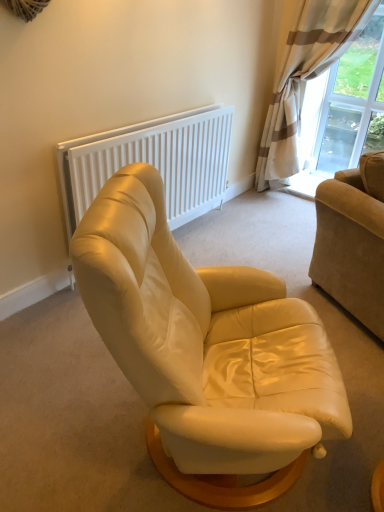
Question: Can you confirm if matte cream leather armchair at center is bigger than beige striped curtain at upper right?

Choices:
 (A) yes
 (B) no

Answer: (B)

Question: Is there a large distance between matte cream leather armchair at center and beige striped curtain at upper right?

Choices:
 (A) no
 (B) yes

Answer: (B)

Question: Can you confirm if matte cream leather armchair at center is shorter than beige striped curtain at upper right?

Choices:
 (A) no
 (B) yes

Answer: (B)

Question: Is matte cream leather armchair at center positioned with its back to beige striped curtain at upper right?

Choices:
 (A) no
 (B) yes

Answer: (A)

Question: Considering the relative positions of matte cream leather armchair at center and beige striped curtain at upper right in the image provided, is matte cream leather armchair at center to the left of beige striped curtain at upper right from the viewer's perspective?

Choices:
 (A) no
 (B) yes

Answer: (B)

Question: Is matte cream leather armchair at center not within beige striped curtain at upper right?

Choices:
 (A) yes
 (B) no

Answer: (A)

Question: From the image's perspective, would you say beige corduroy couch at right is positioned over transparent glass window at upper right?

Choices:
 (A) no
 (B) yes

Answer: (A)

Question: Can you confirm if beige corduroy couch at right is wider than transparent glass window at upper right?

Choices:
 (A) yes
 (B) no

Answer: (A)

Question: Would you say transparent glass window at upper right is part of beige corduroy couch at right's contents?

Choices:
 (A) no
 (B) yes

Answer: (A)

Question: From the image's perspective, is beige corduroy couch at right beneath transparent glass window at upper right?

Choices:
 (A) yes
 (B) no

Answer: (A)

Question: Is the position of beige corduroy couch at right more distant than that of transparent glass window at upper right?

Choices:
 (A) yes
 (B) no

Answer: (B)

Question: Is beige corduroy couch at right not close to transparent glass window at upper right?

Choices:
 (A) no
 (B) yes

Answer: (B)

Question: Considering the relative positions of beige corduroy couch at right and matte cream leather armchair at center in the image provided, is beige corduroy couch at right to the left of matte cream leather armchair at center from the viewer's perspective?

Choices:
 (A) yes
 (B) no

Answer: (B)